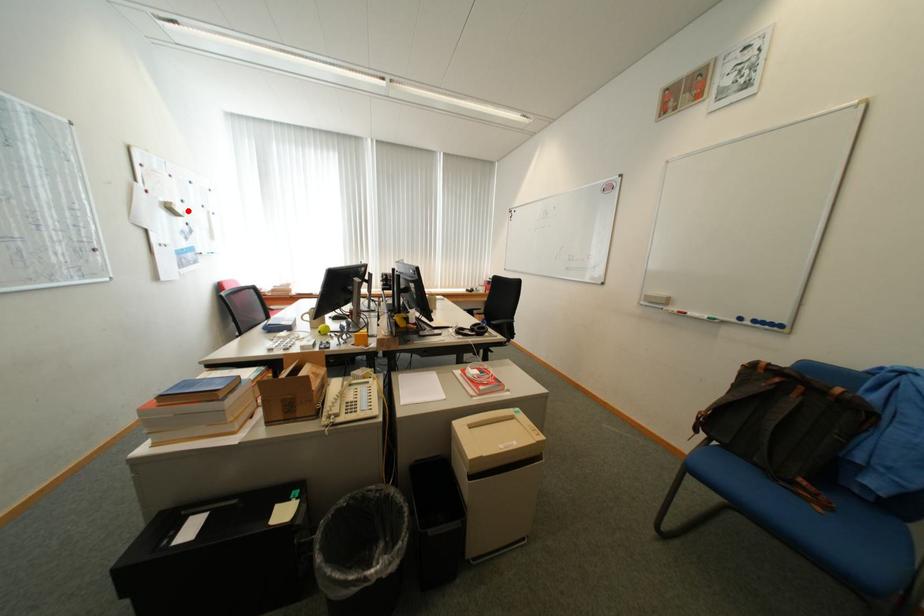
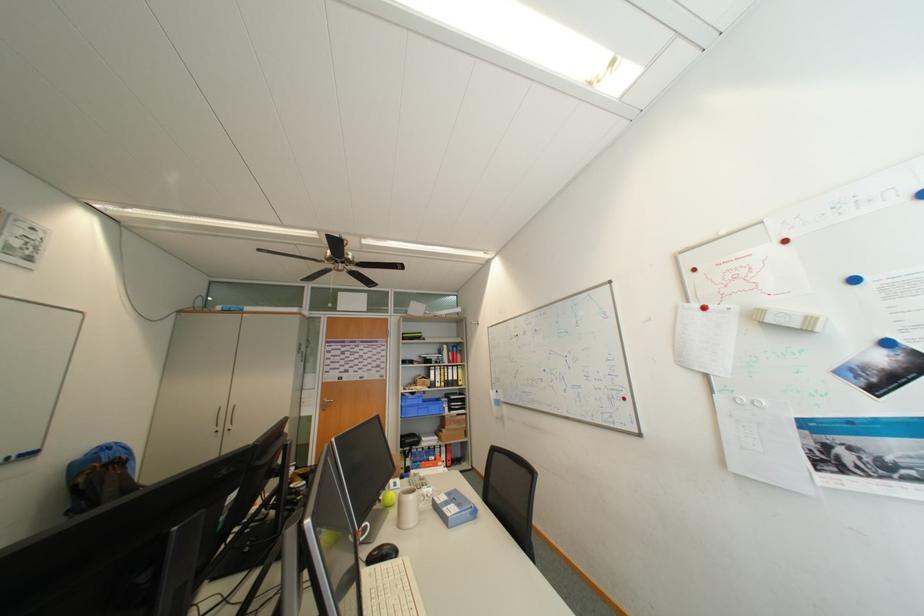
The point at the highlighted location is marked in the first image. Where is the corresponding point in the second image?

(777, 322)